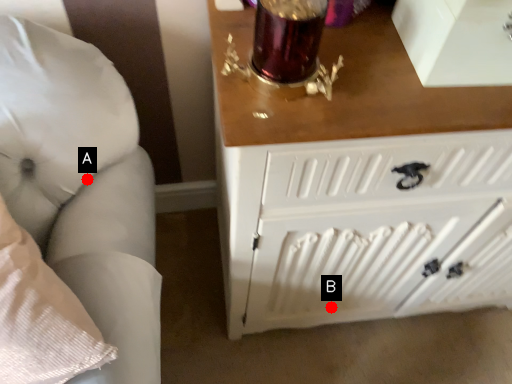
Question: Two points are circled on the image, labeled by A and B beside each circle. Which point is farther to the camera?

Choices:
 (A) A is further
 (B) B is further

Answer: (B)